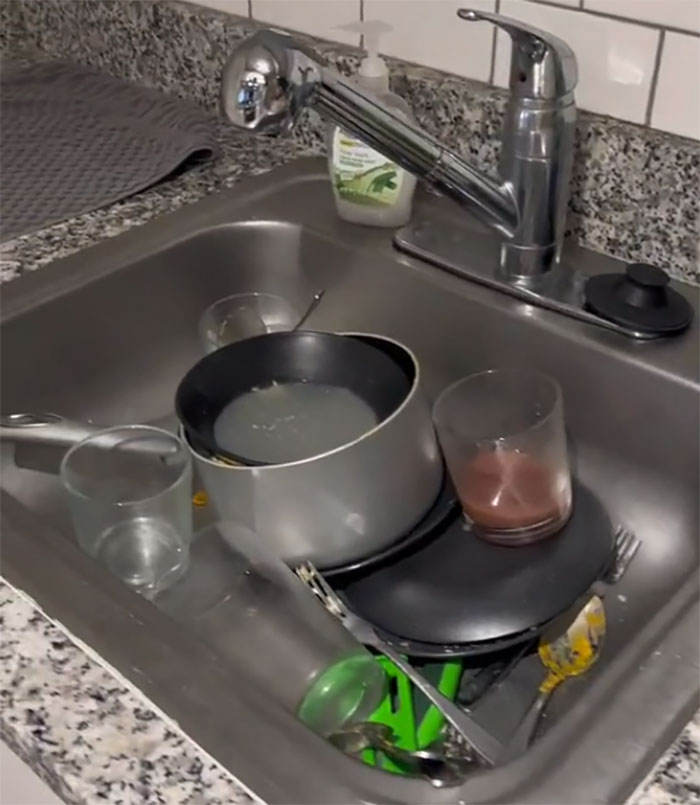
This screenshot has height=805, width=700. Find the location of `sink plug`. sink plug is located at coordinates pyautogui.click(x=637, y=315).